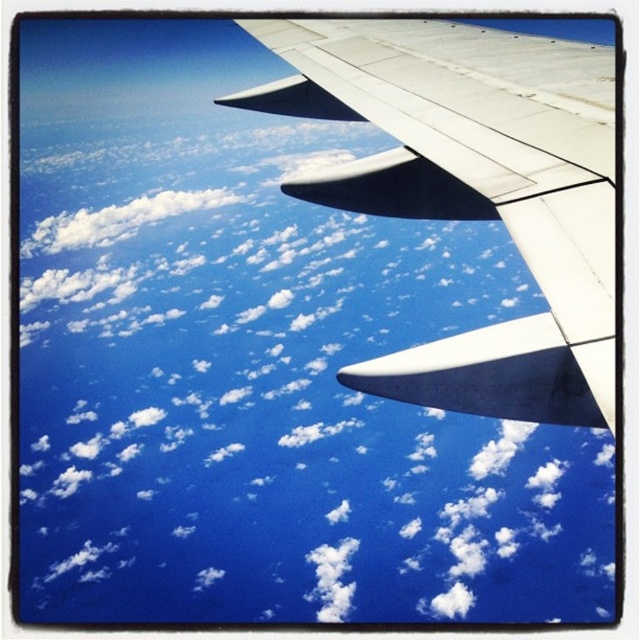
Which of these two, white fluffy cloud at upper center or white matte wing at upper right, stands taller?

Standing taller between the two is white fluffy cloud at upper center.

Who is more forward, (x=605, y=595) or (x=598, y=314)?

Point (x=598, y=314)

Where is `white fluffy cloud at upper center`? Image resolution: width=640 pixels, height=640 pixels. white fluffy cloud at upper center is located at coordinates (272, 397).